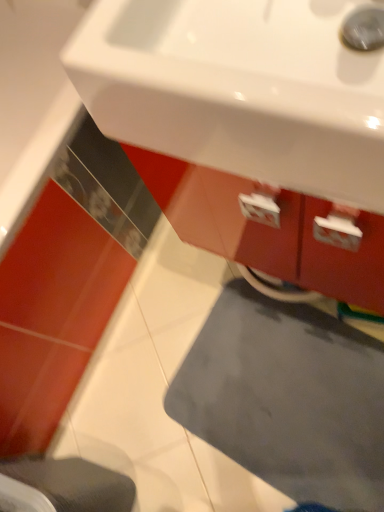
Question: Could you tell me if white glossy sink at upper center is turned towards gray fabric step stool at lower left?

Choices:
 (A) yes
 (B) no

Answer: (B)

Question: Considering the relative sizes of white glossy sink at upper center and gray fabric step stool at lower left in the image provided, is white glossy sink at upper center taller than gray fabric step stool at lower left?

Choices:
 (A) yes
 (B) no

Answer: (B)

Question: Is white glossy sink at upper center positioned beyond the bounds of gray fabric step stool at lower left?

Choices:
 (A) yes
 (B) no

Answer: (A)

Question: Is white glossy sink at upper center to the left of gray fabric step stool at lower left from the viewer's perspective?

Choices:
 (A) no
 (B) yes

Answer: (A)

Question: Is white glossy sink at upper center behind gray fabric step stool at lower left?

Choices:
 (A) yes
 (B) no

Answer: (B)

Question: Considering their positions, is gray matte bath mat at lower center located in front of or behind gray fabric step stool at lower left?

Choices:
 (A) front
 (B) behind

Answer: (B)

Question: Is gray matte bath mat at lower center to the left or to the right of gray fabric step stool at lower left in the image?

Choices:
 (A) right
 (B) left

Answer: (A)

Question: Is gray matte bath mat at lower center wider or thinner than gray fabric step stool at lower left?

Choices:
 (A) wide
 (B) thin

Answer: (A)

Question: Is point (241, 349) closer or farther from the camera than point (11, 473)?

Choices:
 (A) farther
 (B) closer

Answer: (A)

Question: From their relative heights in the image, would you say gray fabric step stool at lower left is taller or shorter than gray matte bath mat at lower center?

Choices:
 (A) tall
 (B) short

Answer: (A)

Question: Visually, is gray fabric step stool at lower left positioned to the left or to the right of gray matte bath mat at lower center?

Choices:
 (A) right
 (B) left

Answer: (B)

Question: Is gray fabric step stool at lower left inside or outside of gray matte bath mat at lower center?

Choices:
 (A) inside
 (B) outside

Answer: (B)

Question: Is gray fabric step stool at lower left bigger or smaller than gray matte bath mat at lower center?

Choices:
 (A) small
 (B) big

Answer: (B)

Question: Would you say gray matte bath mat at lower center is inside or outside white glossy sink at upper center?

Choices:
 (A) outside
 (B) inside

Answer: (A)

Question: Visually, is gray matte bath mat at lower center positioned to the left or to the right of white glossy sink at upper center?

Choices:
 (A) right
 (B) left

Answer: (A)